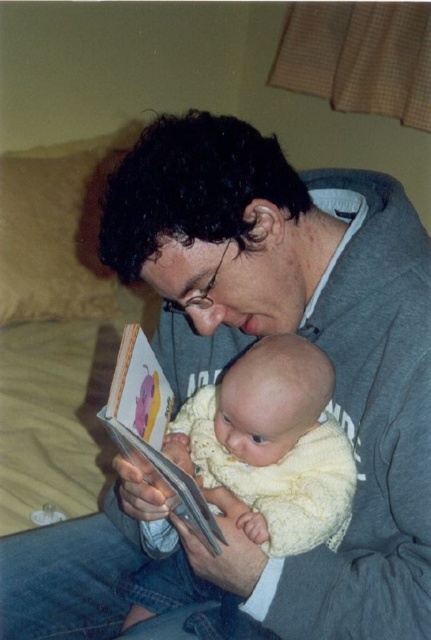
Between soft yellow knit at center and hardcover book at center, which one appears on the left side from the viewer's perspective?

From the viewer's perspective, hardcover book at center appears more on the left side.

Is point (331, 456) closer to camera compared to point (134, 394)?

No, (331, 456) is further to viewer.

Measure the distance between point (340,458) and camera.

The distance of point (340,458) from camera is 30.69 inches.

I want to click on soft yellow knit at center, so click(271, 445).